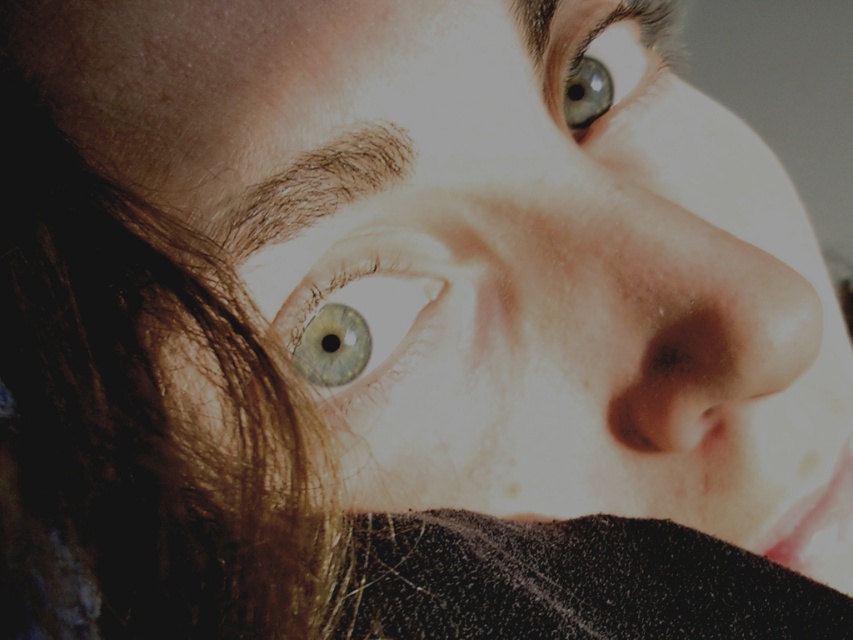
Is light blue glossy eye at center thinner than matte blue eye at upper center?

Yes.

Is point (399, 241) positioned before point (538, 35)?

That is True.

Where is `light blue glossy eye at center`? This screenshot has width=853, height=640. light blue glossy eye at center is located at coordinates (363, 310).

Between light blue glossy eye at center and brown hair at upper center, which one has more height?

Standing taller between the two is light blue glossy eye at center.

Can you confirm if light blue glossy eye at center is smaller than brown hair at upper center?

No.

This screenshot has width=853, height=640. What do you see at coordinates (363, 310) in the screenshot?
I see `light blue glossy eye at center` at bounding box center [363, 310].

Image resolution: width=853 pixels, height=640 pixels. Identify the location of light blue glossy eye at center. (363, 310).

Is brown hair at upper center positioned behind matte blue eye at upper center?

No.

Describe the element at coordinates (311, 188) in the screenshot. The width and height of the screenshot is (853, 640). I see `brown hair at upper center` at that location.

The image size is (853, 640). Find the location of `brown hair at upper center`. brown hair at upper center is located at coordinates (311, 188).